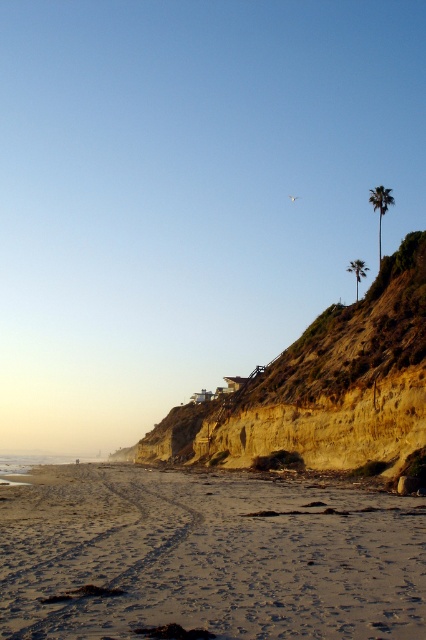
You are standing at the center of the image and want to walk to the sandy beach at lower left. According to the coordinates, which direction should you head?

The sandy beach at lower left is located at coordinates point (207,554). Since the coordinates are lower left, you should head towards the lower left direction to reach it.

You are standing on the sandy beach at lower left and want to take a photo of the green leafy palm tree at upper right. Will the palm tree be fully visible in your photo if you don

The sandy beach at lower left is in front of the green leafy palm tree at upper right, so the palm tree will be fully visible in your photo since it is behind the beach.